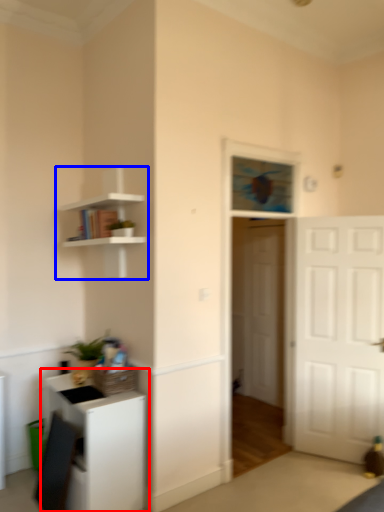
Question: Which of the following is the closest to the observer, cabinetry (highlighted by a red box) or shelf (highlighted by a blue box)?

Choices:
 (A) cabinetry
 (B) shelf

Answer: (A)